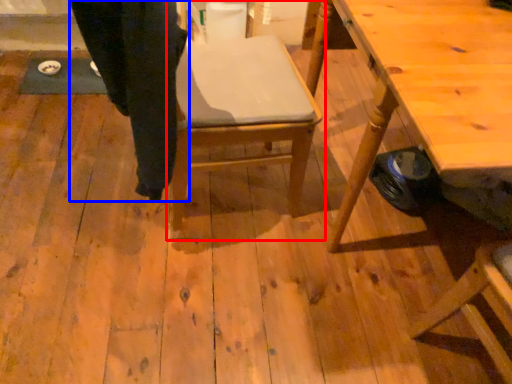
Question: Which of the following is the farthest to the observer, chair (highlighted by a red box) or trousers (highlighted by a blue box)?

Choices:
 (A) chair
 (B) trousers

Answer: (A)